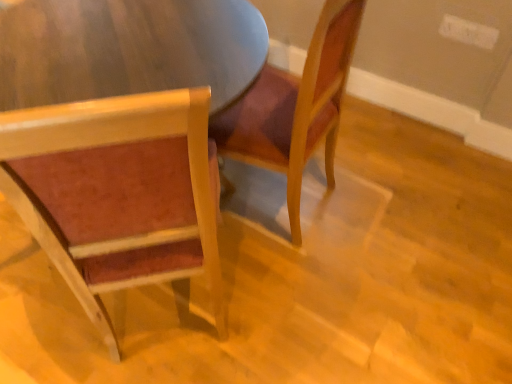
Question: Considering the positions of point (145, 150) and point (330, 69), is point (145, 150) closer or farther from the camera than point (330, 69)?

Choices:
 (A) farther
 (B) closer

Answer: (B)

Question: Looking at their shapes, would you say matte wood chair at left, acting as the 2th chair starting from the right, is wider or thinner than velvet-like red chair at center, the 2th chair positioned from the left?

Choices:
 (A) thin
 (B) wide

Answer: (B)

Question: Considering their positions, is matte wood chair at left, acting as the 1th chair starting from the left, located in front of or behind velvet-like red chair at center, the 2th chair positioned from the left?

Choices:
 (A) behind
 (B) front

Answer: (B)

Question: From a real-world perspective, is velvet-like red chair at center, the 2th chair positioned from the left, positioned above or below matte wood chair at left, acting as the 1th chair starting from the left?

Choices:
 (A) above
 (B) below

Answer: (B)

Question: Is point (304, 122) positioned closer to the camera than point (72, 269)?

Choices:
 (A) closer
 (B) farther

Answer: (B)

Question: In the image, is velvet-like red chair at center, the first chair positioned from the right, positioned in front of or behind matte wood chair at left, acting as the 1th chair starting from the left?

Choices:
 (A) behind
 (B) front

Answer: (A)

Question: From the image's perspective, is velvet-like red chair at center, the first chair positioned from the right, located above or below matte wood chair at left, acting as the 1th chair starting from the left?

Choices:
 (A) below
 (B) above

Answer: (B)